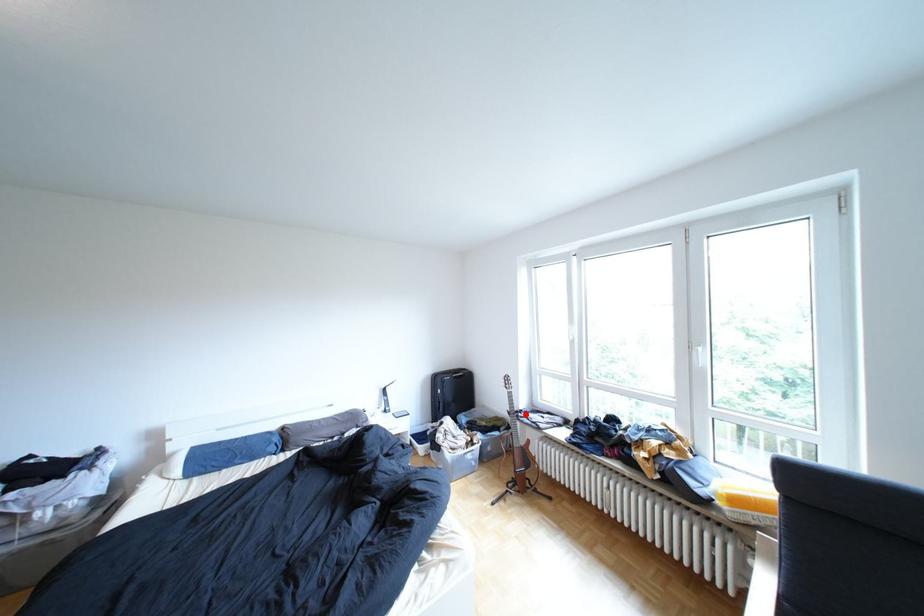
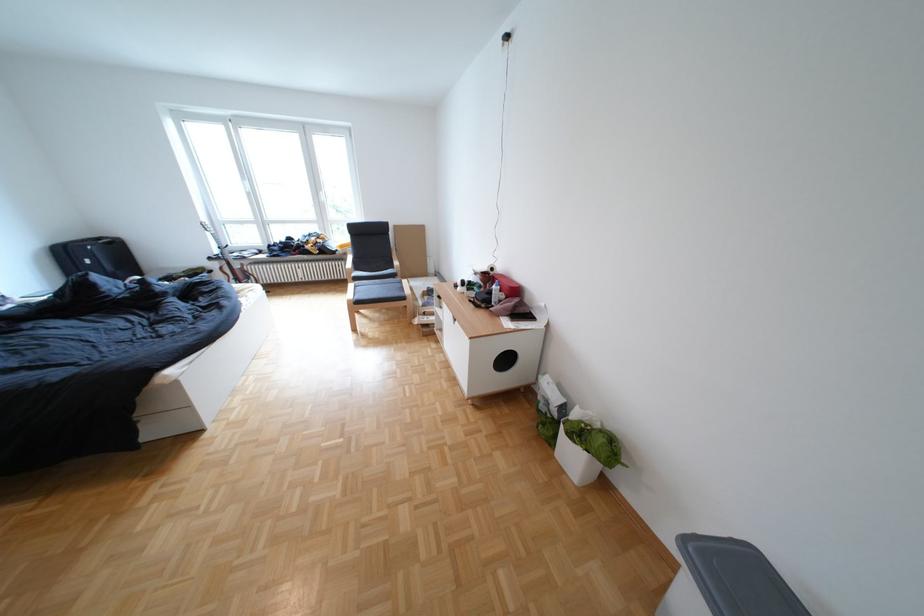
In the second image, find the point that corresponds to the highlighted location in the first image.

(225, 259)